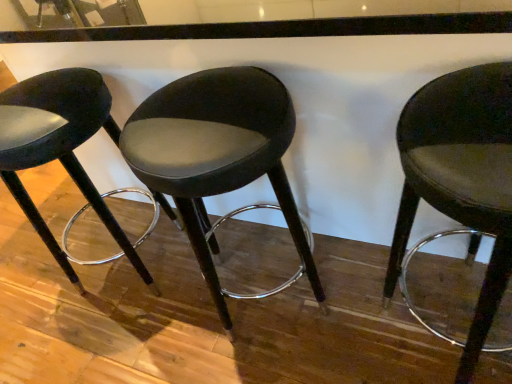
Question: From a real-world perspective, is satin black stool at left, acting as the 1th chair starting from the left, beneath suede-like black stool at center, the 2th chair positioned from the right?

Choices:
 (A) yes
 (B) no

Answer: (B)

Question: Is satin black stool at left, acting as the 1th chair starting from the left, positioned far away from suede-like black stool at center, the 2th chair positioned from the right?

Choices:
 (A) yes
 (B) no

Answer: (B)

Question: Is satin black stool at left, which ranks as the third chair in right-to-left order, further to the viewer compared to suede-like black stool at center, arranged as the second chair when viewed from the left?

Choices:
 (A) no
 (B) yes

Answer: (B)

Question: Could you tell me if satin black stool at left, acting as the 1th chair starting from the left, is facing suede-like black stool at center, the 2th chair positioned from the right?

Choices:
 (A) yes
 (B) no

Answer: (B)

Question: From a real-world perspective, is satin black stool at left, which ranks as the third chair in right-to-left order, on suede-like black stool at center, the 2th chair positioned from the right?

Choices:
 (A) no
 (B) yes

Answer: (B)

Question: Considering the relative sizes of satin black stool at left, which ranks as the third chair in right-to-left order, and suede-like black stool at center, the 2th chair positioned from the right, in the image provided, is satin black stool at left, which ranks as the third chair in right-to-left order, bigger than suede-like black stool at center, the 2th chair positioned from the right,?

Choices:
 (A) yes
 (B) no

Answer: (B)

Question: Can you confirm if suede-like black stool at center, the 2th chair positioned from the right, is positioned to the left of satin black stool at left, acting as the 1th chair starting from the left?

Choices:
 (A) yes
 (B) no

Answer: (B)

Question: Does suede-like black stool at center, the 2th chair positioned from the right, appear on the right side of satin black stool at left, acting as the 1th chair starting from the left?

Choices:
 (A) yes
 (B) no

Answer: (A)

Question: From a real-world perspective, is suede-like black stool at center, the 2th chair positioned from the right, beneath satin black stool at left, which ranks as the third chair in right-to-left order?

Choices:
 (A) no
 (B) yes

Answer: (B)

Question: Is suede-like black stool at center, the 2th chair positioned from the right, positioned with its back to satin black stool at left, acting as the 1th chair starting from the left?

Choices:
 (A) yes
 (B) no

Answer: (B)

Question: Could you tell me if suede-like black stool at center, arranged as the second chair when viewed from the left, is facing satin black stool at left, acting as the 1th chair starting from the left?

Choices:
 (A) yes
 (B) no

Answer: (B)

Question: Does suede-like black stool at center, the 2th chair positioned from the right, lie in front of satin black stool at left, which ranks as the third chair in right-to-left order?

Choices:
 (A) no
 (B) yes

Answer: (B)

Question: Does satin black stool at left, acting as the 1th chair starting from the left, have a larger size compared to matte black stool at right, which is the 3th chair from left to right?

Choices:
 (A) no
 (B) yes

Answer: (B)